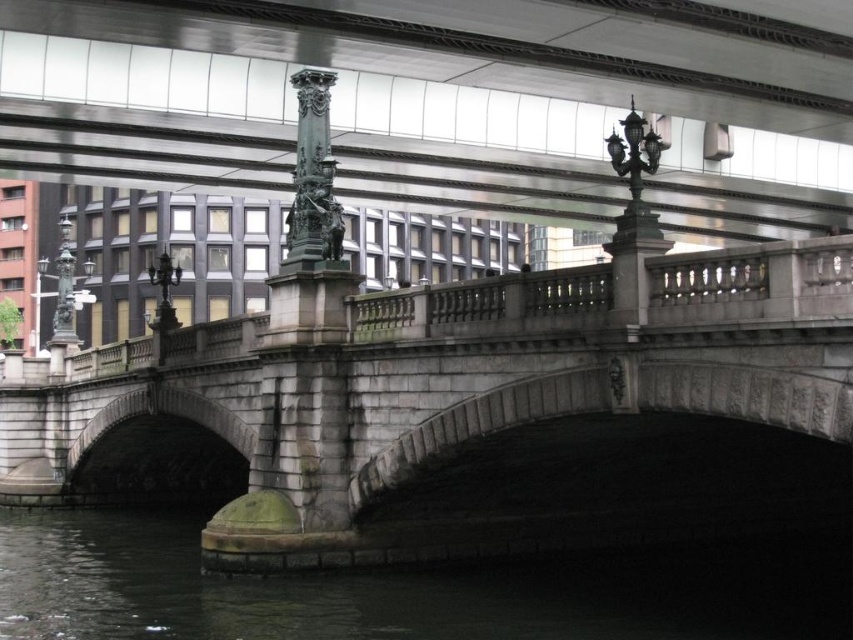
You are standing on the stone bridge and want to locate the bronze ornate column at center. Can you tell me where the point with coordinates point (312, 179) is located?

The point with coordinates point (312, 179) is on bronze ornate column at center.

You are standing on the stone bridge and notice a bronze ornate column at center. There is a point marked at coordinates (312, 179). Is this point located on the bronze ornate column at center?

Yes, the point (312, 179) is on the bronze ornate column at center as stated in the objects description.

You are an urban planner assessing the spacing between the bronze ornate column at center and the polished bronze lamp post at center on the stone bridge. According to the city regulations, the minimum distance between such structures must be at least 60 feet to allow for maintenance access. Is the current spacing compliant with the regulations?

The bronze ornate column at center and polished bronze lamp post at center are 62.19 feet apart from each other, which exceeds the minimum required distance of 60 feet. Therefore, the current spacing is compliant with the city regulations.